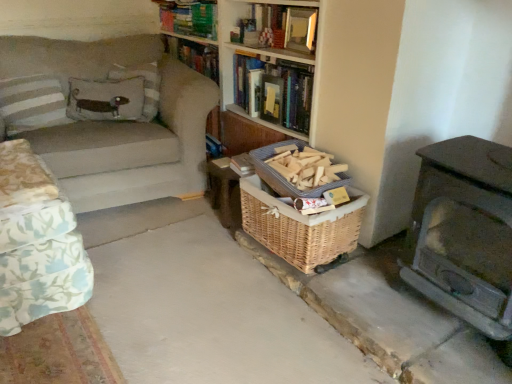
Question: Considering the relative sizes of woven wood table at center and yellow paper at upper center in the image provided, is woven wood table at center thinner than yellow paper at upper center?

Choices:
 (A) no
 (B) yes

Answer: (A)

Question: From the image's perspective, is woven wood table at center on top of yellow paper at upper center?

Choices:
 (A) no
 (B) yes

Answer: (A)

Question: Can you confirm if woven wood table at center is positioned to the right of yellow paper at upper center?

Choices:
 (A) yes
 (B) no

Answer: (B)

Question: Is woven wood table at center in front of yellow paper at upper center?

Choices:
 (A) yes
 (B) no

Answer: (A)

Question: Is the position of woven wood table at center more distant than that of yellow paper at upper center?

Choices:
 (A) yes
 (B) no

Answer: (B)

Question: Is woven wood table at center shorter than yellow paper at upper center?

Choices:
 (A) no
 (B) yes

Answer: (A)

Question: Is woven wood table at center positioned with its back to woven wood basket at lower center, which ranks as the 1th basket in bottom-to-top order?

Choices:
 (A) yes
 (B) no

Answer: (B)

Question: Can you confirm if woven wood table at center is taller than woven wood basket at lower center, which ranks as the 1th basket in bottom-to-top order?

Choices:
 (A) yes
 (B) no

Answer: (A)

Question: From a real-world perspective, is woven wood table at center physically above woven wood basket at lower center, marked as the second basket in a top-to-bottom arrangement?

Choices:
 (A) no
 (B) yes

Answer: (A)

Question: Considering the relative sizes of woven wood table at center and woven wood basket at lower center, marked as the second basket in a top-to-bottom arrangement, in the image provided, is woven wood table at center shorter than woven wood basket at lower center, marked as the second basket in a top-to-bottom arrangement,?

Choices:
 (A) no
 (B) yes

Answer: (A)

Question: Are woven wood table at center and woven wood basket at lower center, marked as the second basket in a top-to-bottom arrangement, beside each other?

Choices:
 (A) no
 (B) yes

Answer: (A)

Question: Does woven wood table at center lie in front of woven wood basket at lower center, marked as the second basket in a top-to-bottom arrangement?

Choices:
 (A) no
 (B) yes

Answer: (A)

Question: Is woven brown basket at center, arranged as the 1th basket when viewed from the top, bigger than brown textured basket at lower right?

Choices:
 (A) no
 (B) yes

Answer: (A)